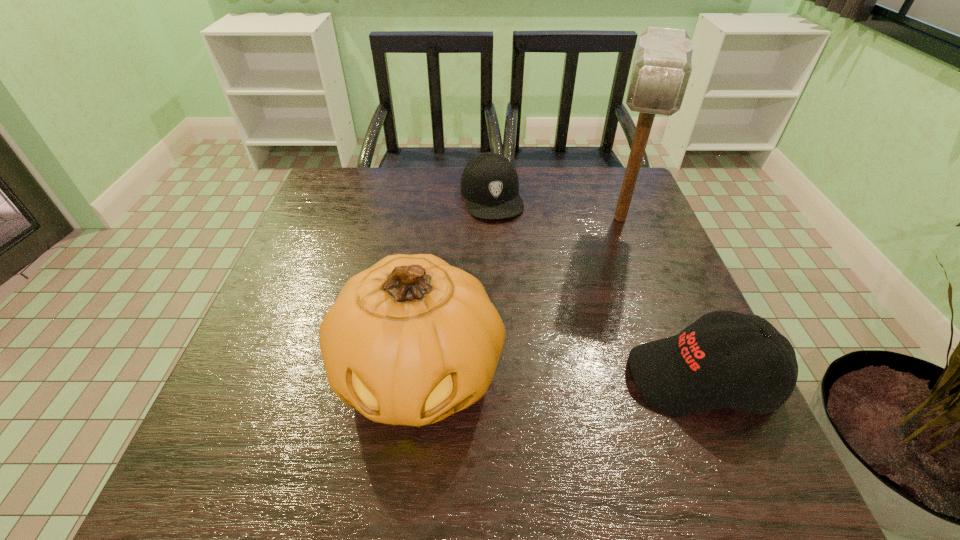
Find the location of `vacant space that satisfies the following two spatial constraints: 1. on the front face of the second shortest object; 2. on the front-facing side of the pumpkin`. vacant space that satisfies the following two spatial constraints: 1. on the front face of the second shortest object; 2. on the front-facing side of the pumpkin is located at coordinates (420, 378).

Locate an element on the screen. The width and height of the screenshot is (960, 540). free spot that satisfies the following two spatial constraints: 1. on the front face of the second shortest object; 2. on the front-facing side of the second tallest object is located at coordinates (420, 378).

You are a GUI agent. You are given a task and a screenshot of the screen. Output one action in this format:
    pyautogui.click(x=<x>, y=<y>)
    Task: Click on the vacant position in the image that satisfies the following two spatial constraints: 1. on the front face of the third shortest object; 2. on the front-facing side of the second shortest object
    The height and width of the screenshot is (540, 960).
    Given the screenshot: What is the action you would take?
    pyautogui.click(x=420, y=378)